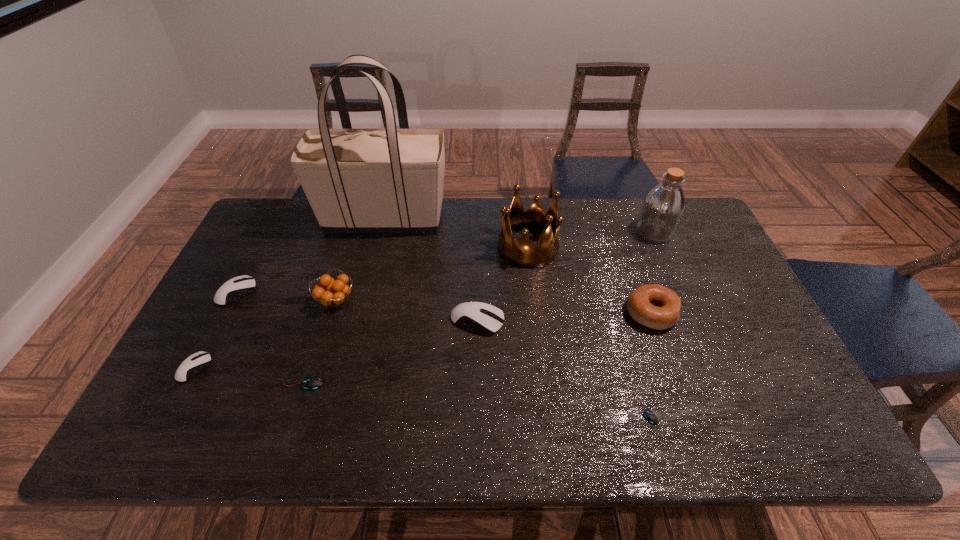
This screenshot has height=540, width=960. In order to click on vacant area between the seventh shortest object and the gray shopping bag in this screenshot , I will do `click(360, 260)`.

Locate an element on the screen. The image size is (960, 540). unoccupied area between the orange fruit and the fourth mouse from left to right is located at coordinates (407, 310).

This screenshot has width=960, height=540. Identify the location of free point between the rightmost white mouse and the bottle. (565, 276).

The height and width of the screenshot is (540, 960). Find the location of `free spot between the bagel and the ninth tallest object`. free spot between the bagel and the ninth tallest object is located at coordinates (475, 349).

Find the location of a particular element. The height and width of the screenshot is (540, 960). unoccupied area between the second tallest mouse and the shopping bag is located at coordinates (311, 256).

Where is `vacant space in between the orange fruit and the bigger black mouse`? This screenshot has width=960, height=540. vacant space in between the orange fruit and the bigger black mouse is located at coordinates (318, 342).

I want to click on free space that is in between the bottle and the fourth shortest object, so click(x=445, y=262).

At what (x,y) coordinates should I click in order to perform the action: click on object that is the fifth closest to the nearest object. Please return your answer as a coordinate pair (x, y). This screenshot has width=960, height=540. Looking at the image, I should click on (390, 180).

Where is `object that ranks as the seventh closest to the farthest mouse`? Image resolution: width=960 pixels, height=540 pixels. object that ranks as the seventh closest to the farthest mouse is located at coordinates (650, 416).

You are a GUI agent. You are given a task and a screenshot of the screen. Output one action in this format:
    pyautogui.click(x=<x>, y=<y>)
    Task: Click on the mouse object that ranks as the closest to the farthest mouse
    
    Given the screenshot: What is the action you would take?
    pyautogui.click(x=191, y=366)